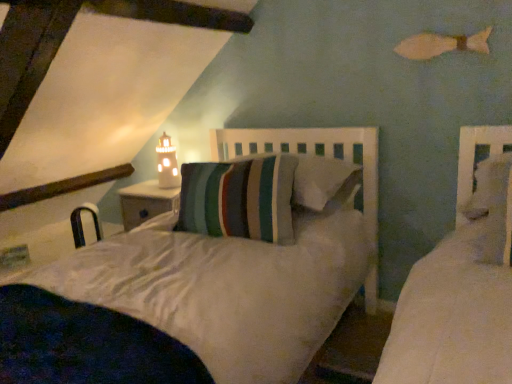
Question: Considering the relative positions of metallic silver chair at lower left and white ceramic lighthouse at upper center in the image provided, is metallic silver chair at lower left to the right of white ceramic lighthouse at upper center from the viewer's perspective?

Choices:
 (A) no
 (B) yes

Answer: (A)

Question: Can you confirm if metallic silver chair at lower left is positioned to the left of white ceramic lighthouse at upper center?

Choices:
 (A) no
 (B) yes

Answer: (B)

Question: From the image's perspective, is metallic silver chair at lower left beneath white ceramic lighthouse at upper center?

Choices:
 (A) yes
 (B) no

Answer: (A)

Question: Is metallic silver chair at lower left positioned beyond the bounds of white ceramic lighthouse at upper center?

Choices:
 (A) no
 (B) yes

Answer: (B)

Question: Considering the relative sizes of metallic silver chair at lower left and white ceramic lighthouse at upper center in the image provided, is metallic silver chair at lower left wider than white ceramic lighthouse at upper center?

Choices:
 (A) yes
 (B) no

Answer: (A)

Question: Does metallic silver chair at lower left lie behind white ceramic lighthouse at upper center?

Choices:
 (A) no
 (B) yes

Answer: (B)

Question: Is metallic silver chair at lower left completely or partially inside white ceramic lighthouse at upper center?

Choices:
 (A) no
 (B) yes

Answer: (A)

Question: From the image's perspective, is white ceramic lighthouse at upper center located beneath metallic silver chair at lower left?

Choices:
 (A) no
 (B) yes

Answer: (A)

Question: Is white ceramic lighthouse at upper center thinner than metallic silver chair at lower left?

Choices:
 (A) no
 (B) yes

Answer: (B)

Question: Does white ceramic lighthouse at upper center appear on the right side of metallic silver chair at lower left?

Choices:
 (A) no
 (B) yes

Answer: (B)

Question: Can you confirm if white ceramic lighthouse at upper center is bigger than metallic silver chair at lower left?

Choices:
 (A) yes
 (B) no

Answer: (B)

Question: Is white ceramic lighthouse at upper center in contact with metallic silver chair at lower left?

Choices:
 (A) no
 (B) yes

Answer: (A)

Question: Are striped fabric pillow at center and white ceramic lighthouse at upper center making contact?

Choices:
 (A) no
 (B) yes

Answer: (A)